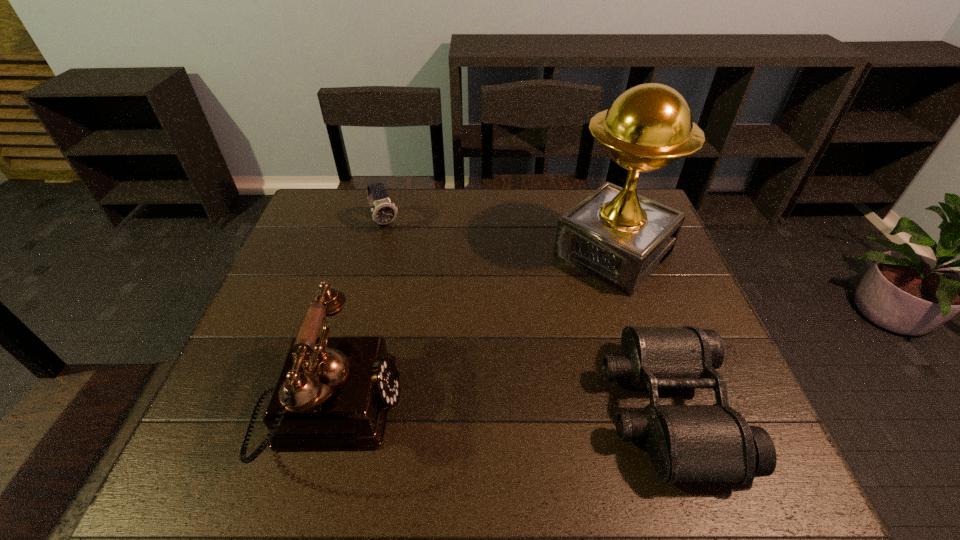
Locate an element on the screen. This screenshot has width=960, height=540. award that is at the right edge is located at coordinates (615, 235).

You are a GUI agent. You are given a task and a screenshot of the screen. Output one action in this format:
    pyautogui.click(x=<x>, y=<y>)
    Task: Click on the object at the near left corner
    This screenshot has height=540, width=960.
    Given the screenshot: What is the action you would take?
    pyautogui.click(x=333, y=392)

Locate an element on the screen. The width and height of the screenshot is (960, 540). object positioned at the far right corner is located at coordinates (615, 235).

The image size is (960, 540). Find the location of `object present at the near right corner`. object present at the near right corner is located at coordinates (686, 443).

At what (x,y) coordinates should I click in order to perform the action: click on vacant region at the far edge of the desktop. Please return your answer as a coordinate pair (x, y). Looking at the image, I should click on (428, 200).

I want to click on free space at the near edge, so click(473, 424).

Identify the location of vacant space at the left edge. (313, 287).

The image size is (960, 540). In order to click on vacant space at the right edge of the desktop in this screenshot , I will do `click(659, 316)`.

In the image, there is a desktop. Identify the location of free space at the far left corner. This screenshot has width=960, height=540. (348, 216).

The width and height of the screenshot is (960, 540). In order to click on unoccupied position between the watch and the telephone in this screenshot , I will do `click(357, 316)`.